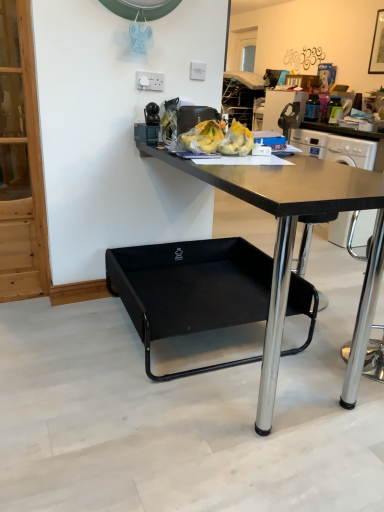
At what (x,y) coordinates should I click in order to perform the action: click on free space on the front side of yellow plastic bananas at center. Please return your answer as a coordinate pair (x, y). Image resolution: width=384 pixels, height=512 pixels. Looking at the image, I should click on (208, 160).